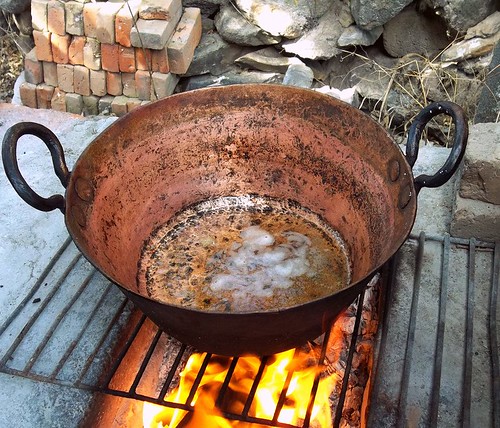
The width and height of the screenshot is (500, 428). I want to click on rightmost handle, so click(x=455, y=152).